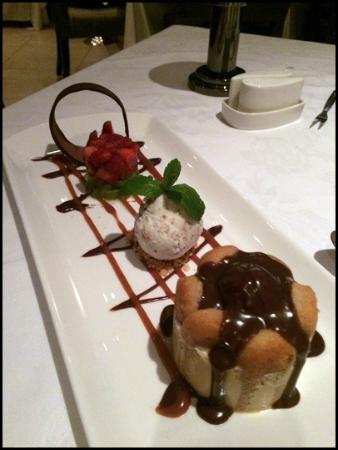
The image size is (338, 450). I want to click on tile floor, so pyautogui.click(x=31, y=69), pyautogui.click(x=87, y=54).